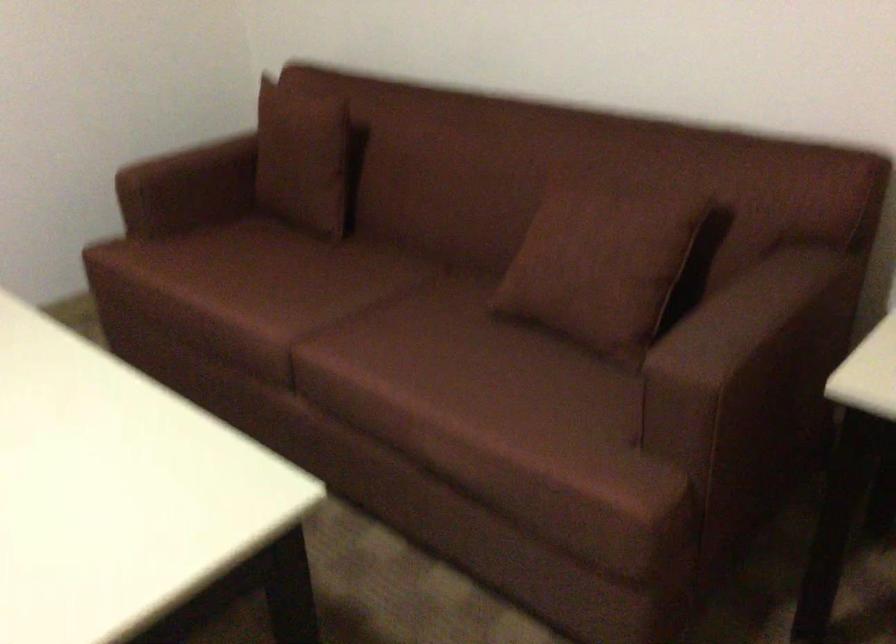
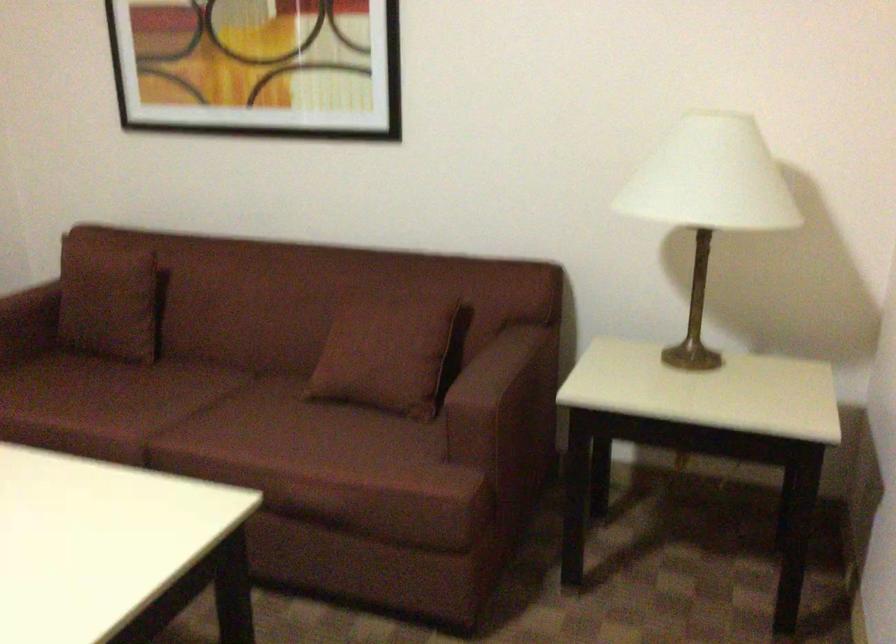
Question: Based on the continuous images, in which direction is the camera rotating? Reply with the corresponding letter.

Choices:
 (A) Left
 (B) Right
 (C) Up
 (D) Down

Answer: (B)